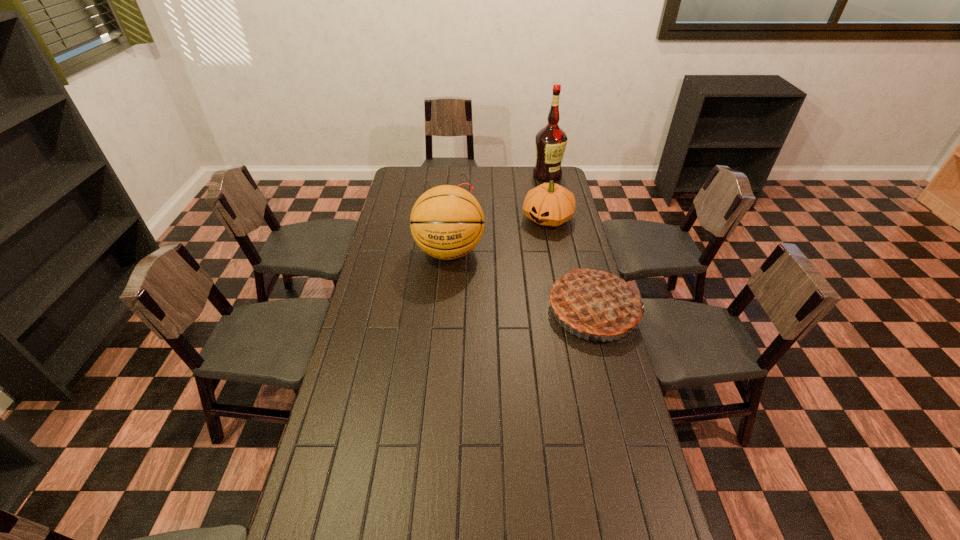
Identify the location of object identified as the fourth closest to the gourd. (595, 302).

Identify which object is located as the fourth nearest to the spectacles. Please provide its 2D coordinates. Your answer should be formatted as a tuple, i.e. [(x, y)], where the tuple contains the x and y coordinates of a point satisfying the conditions above.

[(595, 302)]

Where is `blank space that satisfies the following two spatial constraints: 1. on the surface of the pie near the brand logo; 2. on the right side of the basketball`? blank space that satisfies the following two spatial constraints: 1. on the surface of the pie near the brand logo; 2. on the right side of the basketball is located at coordinates (444, 309).

This screenshot has width=960, height=540. I want to click on vacant space that satisfies the following two spatial constraints: 1. on the front side of the spectacles; 2. on the right side of the third shortest object, so click(437, 309).